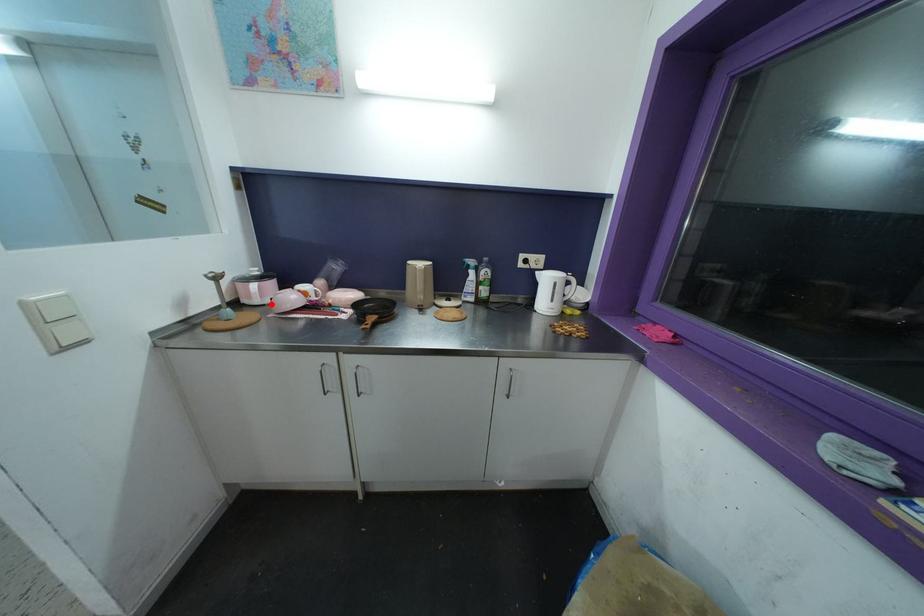
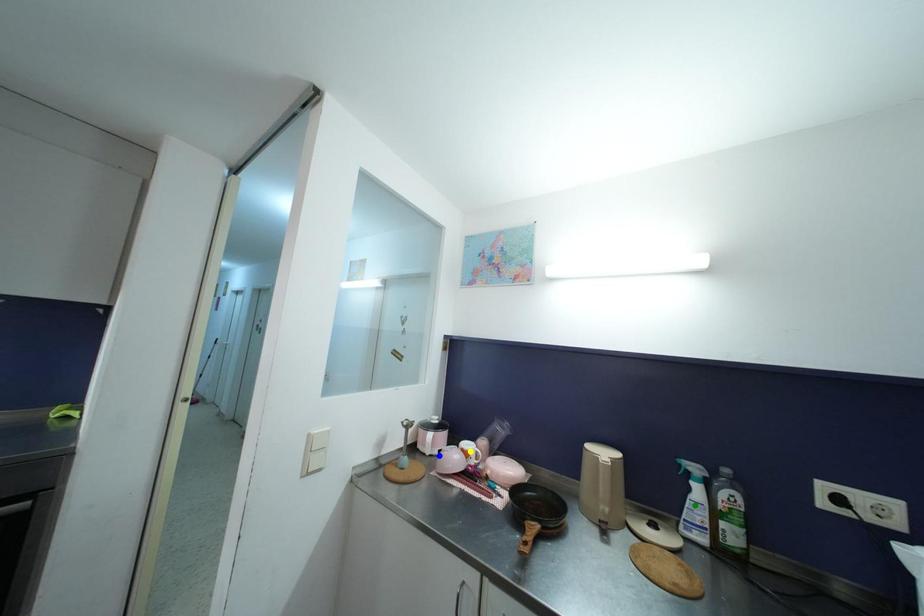
Question: I am providing you with two images of the same scene from different viewpoints. A red point is marked on the first image. You are given multiple points on the second image. Which point in image 2 represents the same 3d spot as the red point in image 1?

Choices:
 (A) yellow point
 (B) green point
 (C) blue point

Answer: (C)